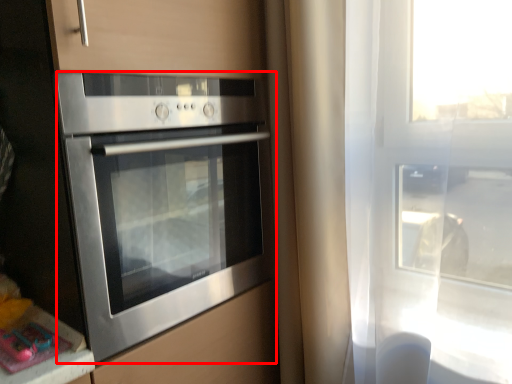
Question: Considering the relative positions of oven (annotated by the red box) and counter top in the image provided, where is oven (annotated by the red box) located with respect to the staircase?

Choices:
 (A) left
 (B) right

Answer: (B)